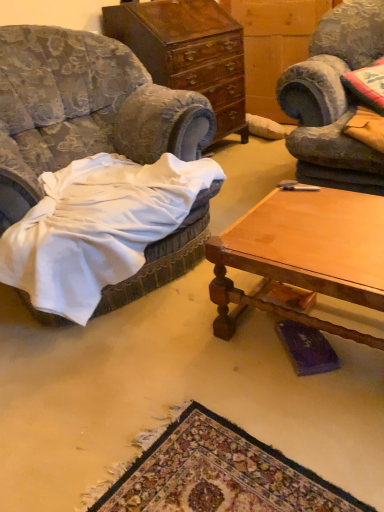
Locate an element on the screen. Image resolution: width=384 pixels, height=512 pixels. free point in front of wooden polished coffee table at center is located at coordinates (293, 436).